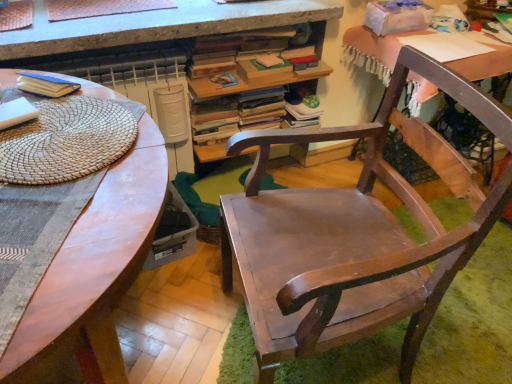
Question: Is wooden desk at upper right, which appears as the second desk when viewed from the left, taller or shorter than matte blue paperback book at upper left?

Choices:
 (A) tall
 (B) short

Answer: (A)

Question: Considering the relative positions of wooden desk at upper right, which appears as the second desk when viewed from the left, and matte blue paperback book at upper left in the image provided, is wooden desk at upper right, which appears as the second desk when viewed from the left, to the left or to the right of matte blue paperback book at upper left?

Choices:
 (A) right
 (B) left

Answer: (A)

Question: Based on their relative distances, which object is farther from the white paper at upper right?

Choices:
 (A) woven beige placemat at left
 (B) wooden desk with books at center
 (C) matte wooden desk at center, which is the 1th desk from left to right
 (D) matte blue paperback book at upper left
 (E) wooden desk at upper right, the 1th desk in the right-to-left sequence

Answer: (C)

Question: Considering the real-world distances, which object is closest to the wooden desk at upper right, the 1th desk in the right-to-left sequence?

Choices:
 (A) white paper at upper right
 (B) wooden chair at center
 (C) wooden book at upper center
 (D) wooden desk with books at center
 (E) woven beige placemat at left

Answer: (A)